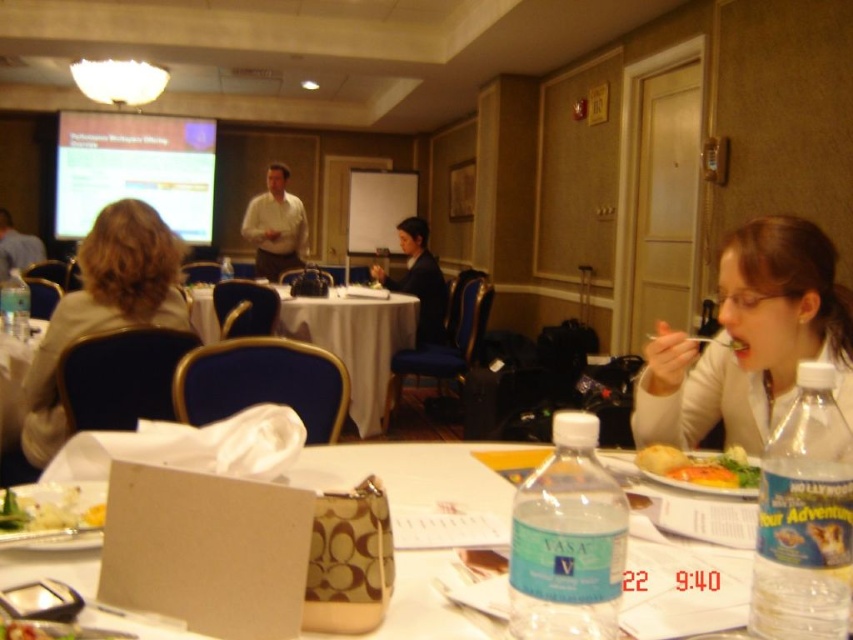
Who is positioned more to the right, white paper at center or matte white projector screen at upper left?

Positioned to the right is white paper at center.

Is point (320, 637) positioned in front of point (61, 225)?

Yes.

Find the location of a particular element. The image size is (853, 640). white paper at center is located at coordinates (418, 472).

Is the position of dark suit jacket at center less distant than that of golden crispy bread at right?

No, it is behind golden crispy bread at right.

What do you see at coordinates (418, 280) in the screenshot? The height and width of the screenshot is (640, 853). I see `dark suit jacket at center` at bounding box center [418, 280].

Is point (427, 288) farther from viewer compared to point (711, 486)?

Yes, point (427, 288) is farther from viewer.

The height and width of the screenshot is (640, 853). Find the location of `dark suit jacket at center`. dark suit jacket at center is located at coordinates (418, 280).

From the picture: Is clear plastic water bottle at lower right shorter than matte white projector screen at upper left?

Indeed, clear plastic water bottle at lower right has a lesser height compared to matte white projector screen at upper left.

Is point (546, 602) farther from viewer compared to point (137, 147)?

No, it is not.

Identify the location of clear plastic water bottle at lower right. (567, 540).